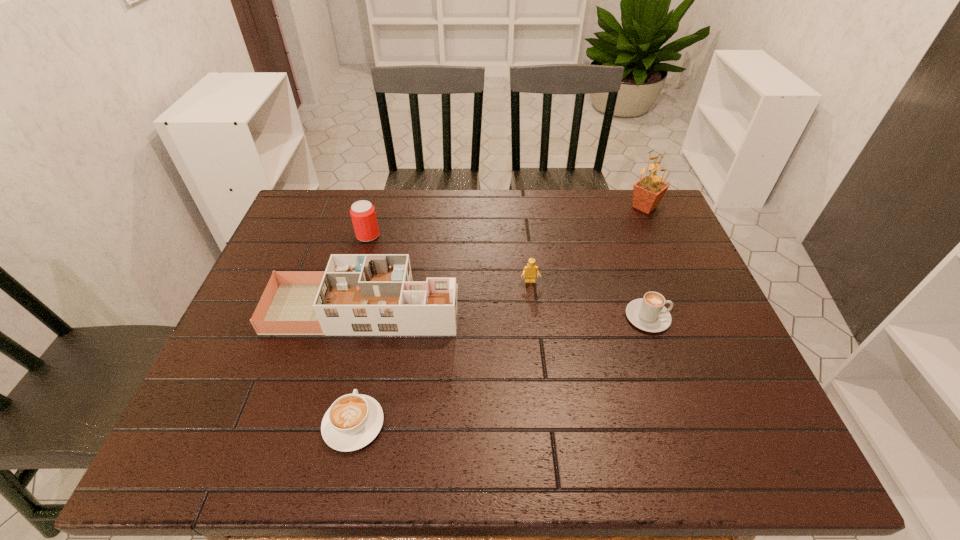
At what (x,y) coordinates should I click in order to perform the action: click on sunflower. Please return your answer as a coordinate pair (x, y). Looking at the image, I should click on (647, 193).

Where is `the farthest object`? Image resolution: width=960 pixels, height=540 pixels. the farthest object is located at coordinates (647, 193).

At what (x,y) coordinates should I click in order to perform the action: click on beer can. Please return your answer as a coordinate pair (x, y). The image size is (960, 540). Looking at the image, I should click on [x=362, y=212].

Find the location of a particular element. dollhouse is located at coordinates (358, 294).

What are the coordinates of `Lego` in the screenshot? It's located at (529, 272).

Find the location of `the fourth object from left to right`. the fourth object from left to right is located at coordinates (529, 272).

You are a GUI agent. You are given a task and a screenshot of the screen. Output one action in this format:
    pyautogui.click(x=<x>, y=<y>)
    Task: Click on the fifth object from left to right
    
    Given the screenshot: What is the action you would take?
    pyautogui.click(x=649, y=314)

Where is `the taller cappuccino`? The image size is (960, 540). the taller cappuccino is located at coordinates (649, 314).

Where is `the left cappuccino`? the left cappuccino is located at coordinates coord(354,420).

You are a GUI agent. You are given a task and a screenshot of the screen. Output one action in this format:
    pyautogui.click(x=<x>, y=<y>)
    Task: Click on the nearest object
    This screenshot has width=960, height=540.
    Given the screenshot: What is the action you would take?
    pyautogui.click(x=354, y=420)